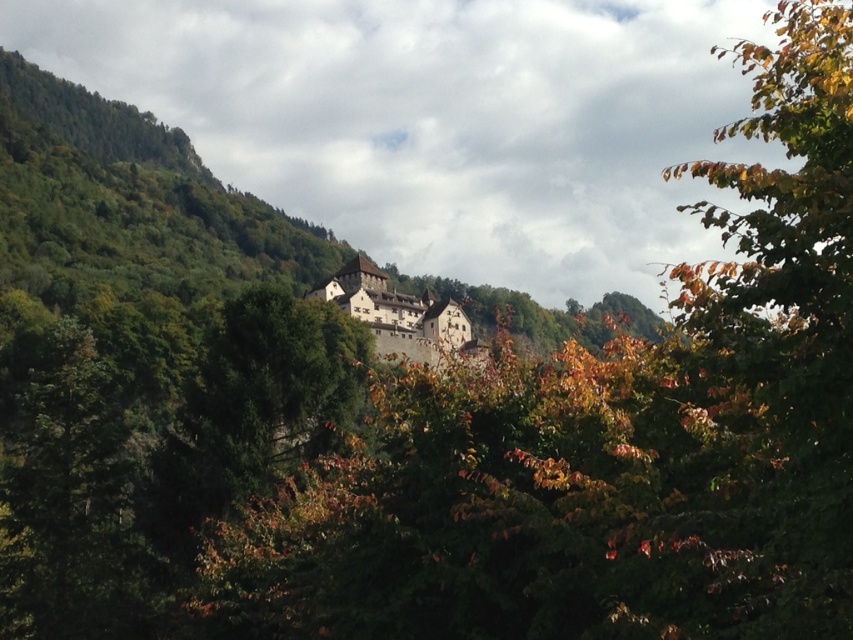
You are an architect evaluating the castle and its surroundings. Based on the scene, which object, the green matte tree at left or the brown stone castle at center, is taller?

The green matte tree at left is taller than the brown stone castle at center according to the description.